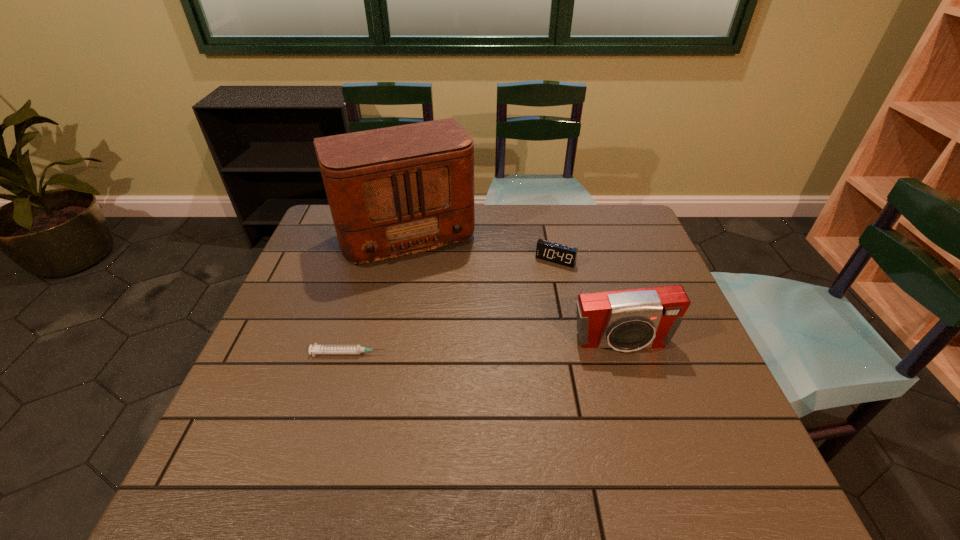
You are a GUI agent. You are given a task and a screenshot of the screen. Output one action in this format:
    pyautogui.click(x=<x>, y=<y>)
    Task: Click on the syringe
    
    Given the screenshot: What is the action you would take?
    pyautogui.click(x=316, y=349)

What are the coordinates of `camera` in the screenshot? It's located at (626, 320).

Identify the location of the second shortest object. Image resolution: width=960 pixels, height=540 pixels. (549, 251).

You are a GUI agent. You are given a task and a screenshot of the screen. Output one action in this format:
    pyautogui.click(x=<x>, y=<y>)
    Task: Click on the radio receiver
    The height and width of the screenshot is (540, 960).
    Given the screenshot: What is the action you would take?
    395,191

You are a GUI agent. You are given a task and a screenshot of the screen. Output one action in this format:
    pyautogui.click(x=<x>, y=<y>)
    Task: Click on the blank space located at the needle end of the syringe
    The image size is (960, 540).
    Given the screenshot: What is the action you would take?
    pyautogui.click(x=550, y=353)

Identify the location of free space located on the front-facing side of the third shortest object. (638, 398).

At what (x,y) coordinates should I click in order to perform the action: click on vacant space situated 0.350m on the front-facing side of the alarm clock. Please return your answer as a coordinate pair (x, y). Looking at the image, I should click on tap(503, 353).

Identify the location of free location located on the front-facing side of the alarm clock. This screenshot has height=540, width=960. (502, 356).

Identify the location of free location located 0.340m on the front-facing side of the alarm clock. (505, 350).

Where is `vacant space situated 0.390m on the front panel of the tallest object`? The height and width of the screenshot is (540, 960). vacant space situated 0.390m on the front panel of the tallest object is located at coordinates (470, 371).